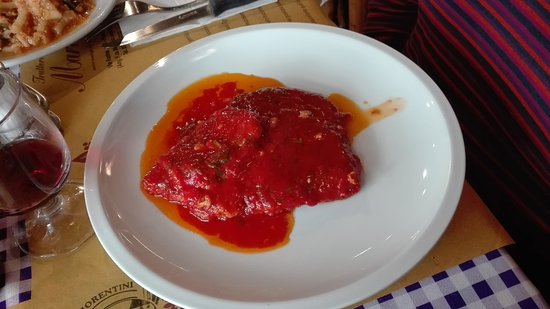
Locate an element on the screen. The width and height of the screenshot is (550, 309). tablecloth is located at coordinates (477, 285), (13, 289), (21, 237), (14, 68).